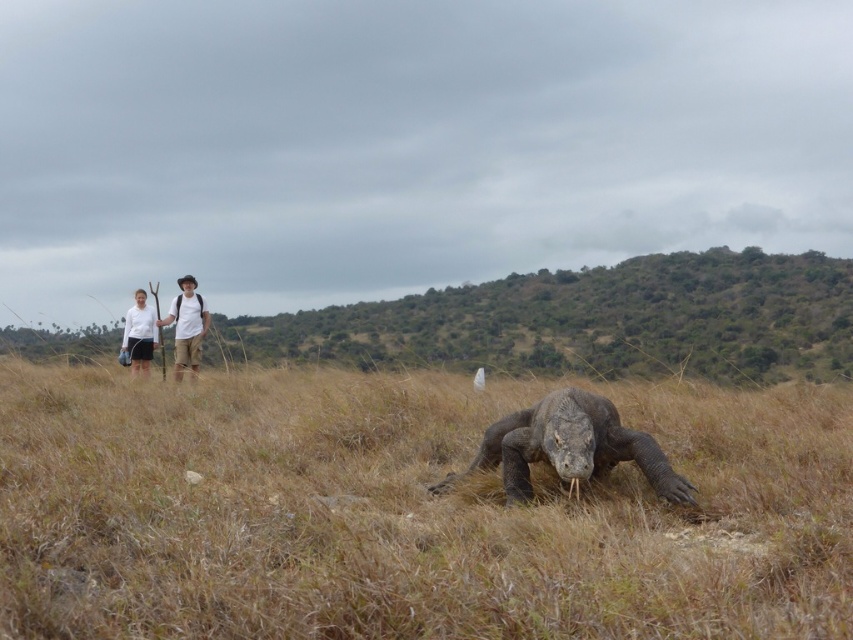
You are a photographer trying to capture a closeup of the gray rough skin at center and the white cotton shirt at center in the image. Since you want both subjects to be clearly visible, which object should you focus on first to ensure proper focus, considering their sizes?

The gray rough skin at center is smaller than the white cotton shirt at center, so you should focus on the gray rough skin at center first to ensure it is in focus before adjusting for the larger white cotton shirt at center.

You are a hiker who wants to safely approach the gray rough skin at center without stepping on the brown dry grass at center. Can you walk through the space between them?

The brown dry grass at center and gray rough skin at center are 3.99 feet apart from each other. Since the distance between them is almost 4 feet, you can walk through the space between them without stepping on the brown dry grass at center.

You are a photographer trying to capture a clear photo of the white cotton shirt at center. However, the brown dry grass at center is blocking your view. Based on the scene, can you determine if the grass is between you and the shirt, or behind the shirt?

The brown dry grass at center is in front of white cotton shirt at center, so the grass is between you and the shirt, blocking the view.